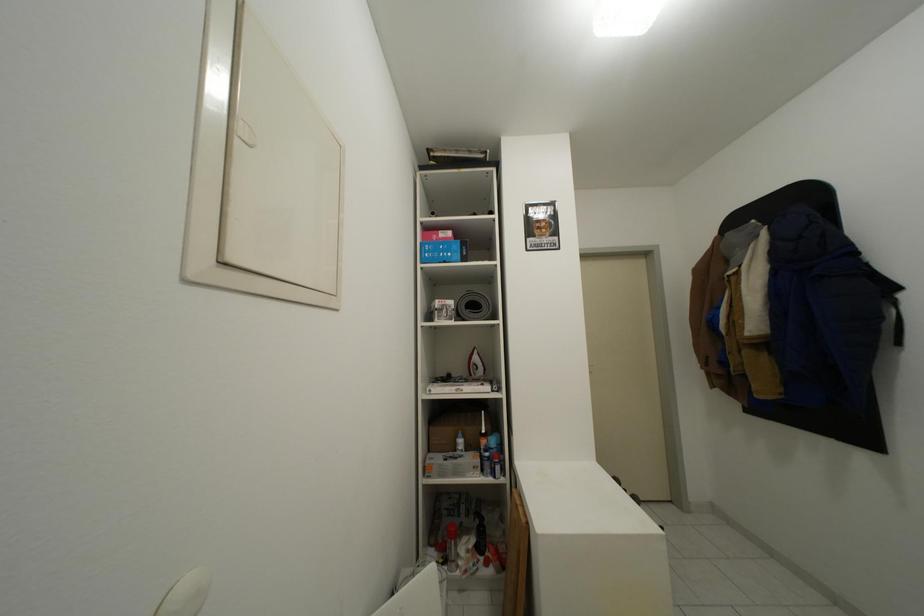
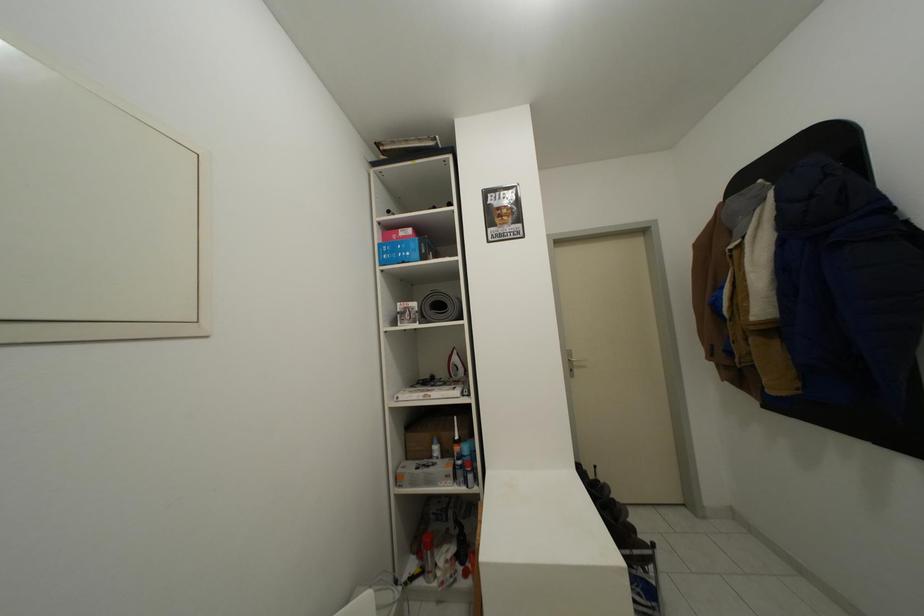
Question: The camera is either moving clockwise (left) or counter-clockwise (right) around the object. The first image is from the beginning of the video and the second image is from the end. Is the camera moving left or right when shooting the video?

Choices:
 (A) Left
 (B) Right

Answer: (B)